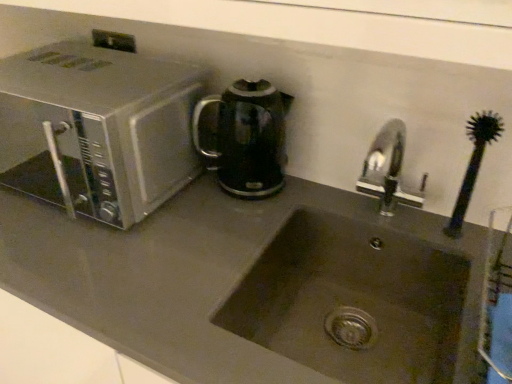
Question: Is black glossy electric kettle at center a part of silver metallic microwave at left?

Choices:
 (A) yes
 (B) no

Answer: (B)

Question: Is silver metallic microwave at left thinner than black glossy electric kettle at center?

Choices:
 (A) no
 (B) yes

Answer: (A)

Question: Considering the relative positions of silver metallic microwave at left and black glossy electric kettle at center in the image provided, is silver metallic microwave at left to the right of black glossy electric kettle at center from the viewer's perspective?

Choices:
 (A) no
 (B) yes

Answer: (A)

Question: Is silver metallic microwave at left further to camera compared to black glossy electric kettle at center?

Choices:
 (A) yes
 (B) no

Answer: (B)

Question: Is silver metallic microwave at left aimed at black glossy electric kettle at center?

Choices:
 (A) yes
 (B) no

Answer: (B)

Question: Is silver metallic microwave at left oriented away from black glossy electric kettle at center?

Choices:
 (A) yes
 (B) no

Answer: (B)

Question: Considering the relative sizes of black glossy electric kettle at center and matte stainless steel sink at center in the image provided, is black glossy electric kettle at center smaller than matte stainless steel sink at center?

Choices:
 (A) no
 (B) yes

Answer: (B)

Question: Considering the relative sizes of black glossy electric kettle at center and matte stainless steel sink at center in the image provided, is black glossy electric kettle at center shorter than matte stainless steel sink at center?

Choices:
 (A) no
 (B) yes

Answer: (A)

Question: From the image's perspective, is black glossy electric kettle at center over matte stainless steel sink at center?

Choices:
 (A) no
 (B) yes

Answer: (B)

Question: Is black glossy electric kettle at center surrounding matte stainless steel sink at center?

Choices:
 (A) no
 (B) yes

Answer: (A)

Question: Is black glossy electric kettle at center looking in the opposite direction of matte stainless steel sink at center?

Choices:
 (A) no
 (B) yes

Answer: (A)

Question: Is black glossy electric kettle at center aimed at matte stainless steel sink at center?

Choices:
 (A) no
 (B) yes

Answer: (A)

Question: Would you say black glossy electric kettle at center is part of metallic stainless steel at upper left's contents?

Choices:
 (A) no
 (B) yes

Answer: (A)